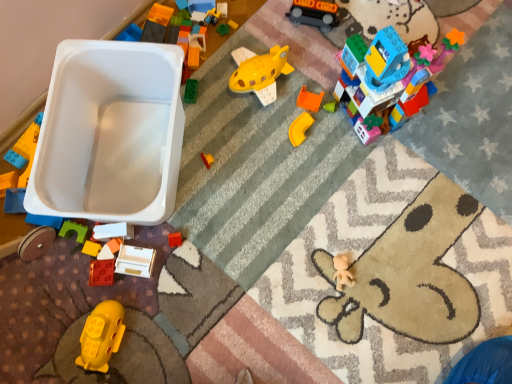
This screenshot has width=512, height=384. I want to click on vacant space that is to the left of rubberized orange block at lower left, acting as the fourth toy starting from the bottom, so click(40, 276).